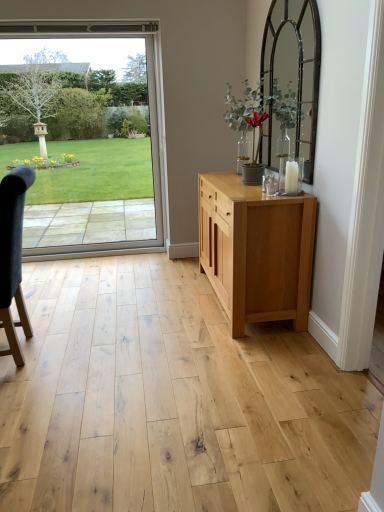
Question: Is dark gray fabric chair at left at the left side of natural wood cabinet at center?

Choices:
 (A) no
 (B) yes

Answer: (B)

Question: Is dark gray fabric chair at left bigger than natural wood cabinet at center?

Choices:
 (A) yes
 (B) no

Answer: (B)

Question: From a real-world perspective, is dark gray fabric chair at left below natural wood cabinet at center?

Choices:
 (A) yes
 (B) no

Answer: (B)

Question: Can you confirm if dark gray fabric chair at left is shorter than natural wood cabinet at center?

Choices:
 (A) no
 (B) yes

Answer: (A)

Question: Is dark gray fabric chair at left positioned with its back to natural wood cabinet at center?

Choices:
 (A) yes
 (B) no

Answer: (A)

Question: Is dark gray fabric chair at left positioned beyond the bounds of natural wood cabinet at center?

Choices:
 (A) no
 (B) yes

Answer: (B)

Question: Is clear glass door at left to the right of dark gray fabric chair at left from the viewer's perspective?

Choices:
 (A) yes
 (B) no

Answer: (B)

Question: Can you see clear glass door at left touching dark gray fabric chair at left?

Choices:
 (A) yes
 (B) no

Answer: (B)

Question: Can we say clear glass door at left lies outside dark gray fabric chair at left?

Choices:
 (A) yes
 (B) no

Answer: (A)

Question: Is the position of clear glass door at left less distant than that of dark gray fabric chair at left?

Choices:
 (A) no
 (B) yes

Answer: (A)

Question: Considering the relative sizes of clear glass door at left and dark gray fabric chair at left in the image provided, is clear glass door at left shorter than dark gray fabric chair at left?

Choices:
 (A) yes
 (B) no

Answer: (B)

Question: Does clear glass door at left have a larger size compared to dark gray fabric chair at left?

Choices:
 (A) no
 (B) yes

Answer: (A)

Question: Would you consider natural wood cabinet at center to be distant from dark gray fabric chair at left?

Choices:
 (A) yes
 (B) no

Answer: (A)